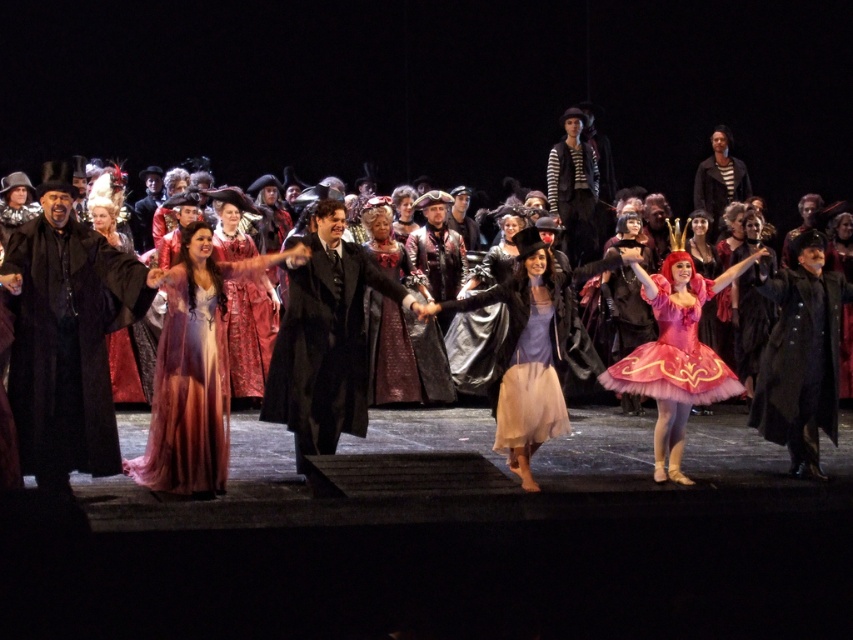
How much distance is there between velvet black robe at left and silky purple gown at center?

velvet black robe at left is 30.26 inches away from silky purple gown at center.

Can you confirm if velvet black robe at left is positioned to the right of silky purple gown at center?

In fact, velvet black robe at left is to the left of silky purple gown at center.

Where is `velvet black robe at left`? velvet black robe at left is located at coordinates (67, 336).

Is matte purple dress at center closer to camera compared to shiny pink tulle dress at lower right?

Yes, it is in front of shiny pink tulle dress at lower right.

Is point (503, 397) positioned after point (679, 317)?

That is False.

Who is more forward, (x=527, y=394) or (x=653, y=380)?

Positioned in front is point (x=527, y=394).

Find the location of a particular element. matte purple dress at center is located at coordinates tap(531, 348).

Is point (630, 260) positioned after point (662, 436)?

Yes, point (630, 260) is farther from viewer.

Can you confirm if matte purple dress at center is bigger than pink tulle tutu at center?

Indeed, matte purple dress at center has a larger size compared to pink tulle tutu at center.

Describe the element at coordinates (531, 348) in the screenshot. The image size is (853, 640). I see `matte purple dress at center` at that location.

Identify the location of matte purple dress at center. (531, 348).